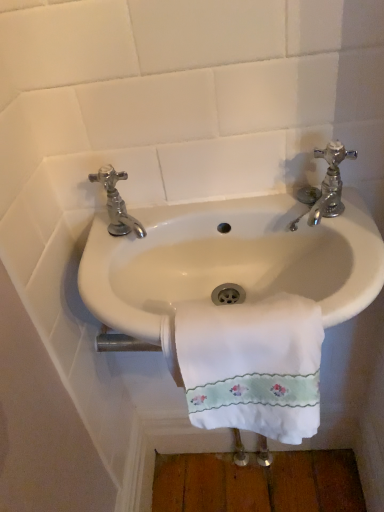
Question: Would you say chrome metallic faucet at upper right, the 2th tap positioned from the left, is inside or outside chrome metallic faucet at left, which is the 1th tap in left-to-right order?

Choices:
 (A) outside
 (B) inside

Answer: (A)

Question: Is chrome metallic faucet at upper right, placed as the first tap when sorted from right to left, taller or shorter than chrome metallic faucet at left, which is the 1th tap in left-to-right order?

Choices:
 (A) tall
 (B) short

Answer: (B)

Question: Estimate the real-world distances between objects in this image. Which object is closer to the white ceramic sink at center?

Choices:
 (A) chrome metallic faucet at left, which is the 1th tap in left-to-right order
 (B) chrome metallic faucet at upper right, the 2th tap positioned from the left
 (C) white embroidered towel at center

Answer: (C)

Question: Estimate the real-world distances between objects in this image. Which object is farther from the chrome metallic faucet at left, which is the 1th tap in left-to-right order?

Choices:
 (A) white embroidered towel at center
 (B) white ceramic sink at center
 (C) chrome metallic faucet at upper right, the 2th tap positioned from the left

Answer: (C)